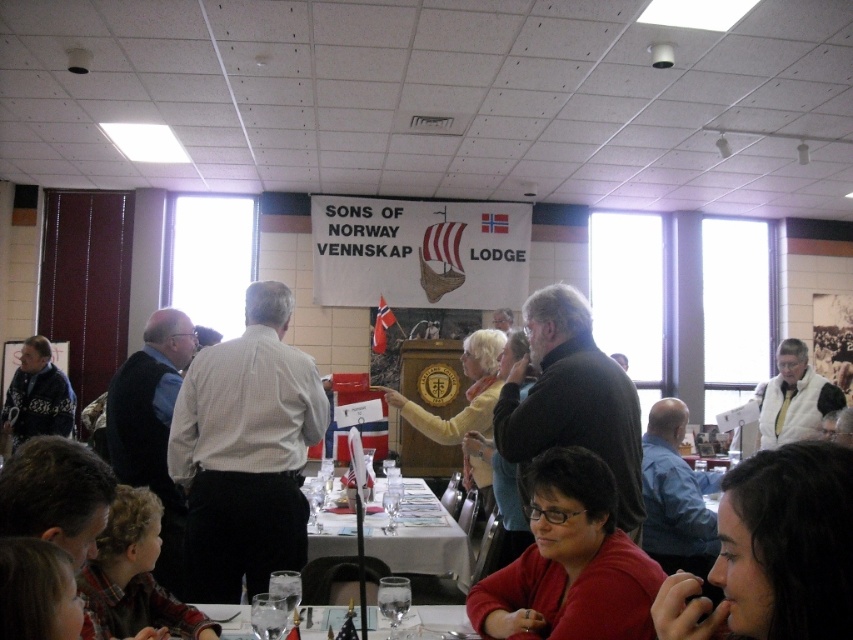
Question: Which of these objects is positioned farthest from the dark brown hair at lower right?

Choices:
 (A) clear glass table at lower center
 (B) white glossy table at center
 (C) white checkered shirt at center
 (D) knitted sweater at left

Answer: (D)

Question: Which is farther from the white glossy table at center?

Choices:
 (A) white checkered shirt at center
 (B) dark brown hair at lower right

Answer: (B)

Question: Is white glossy table at center closer to camera compared to knitted sweater at left?

Choices:
 (A) yes
 (B) no

Answer: (A)

Question: Which object is farther from the camera taking this photo?

Choices:
 (A) blue shirt at right
 (B) black matte jacket at center
 (C) dark brown hair at lower right

Answer: (A)

Question: Can you confirm if dark brown hair at lower right is bigger than knitted sweater at left?

Choices:
 (A) no
 (B) yes

Answer: (A)

Question: Can you confirm if matte red sweater at lower center is positioned to the right of white glossy table at center?

Choices:
 (A) no
 (B) yes

Answer: (B)